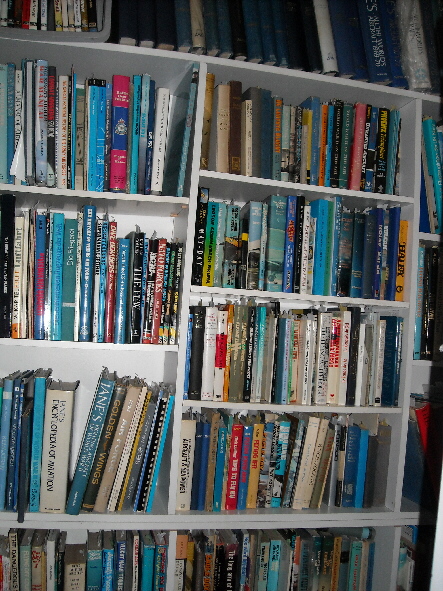
Where is `the bottom of books`? This screenshot has height=591, width=443. the bottom of books is located at coordinates (56, 512), (69, 512), (98, 511), (117, 509), (144, 509), (184, 509).